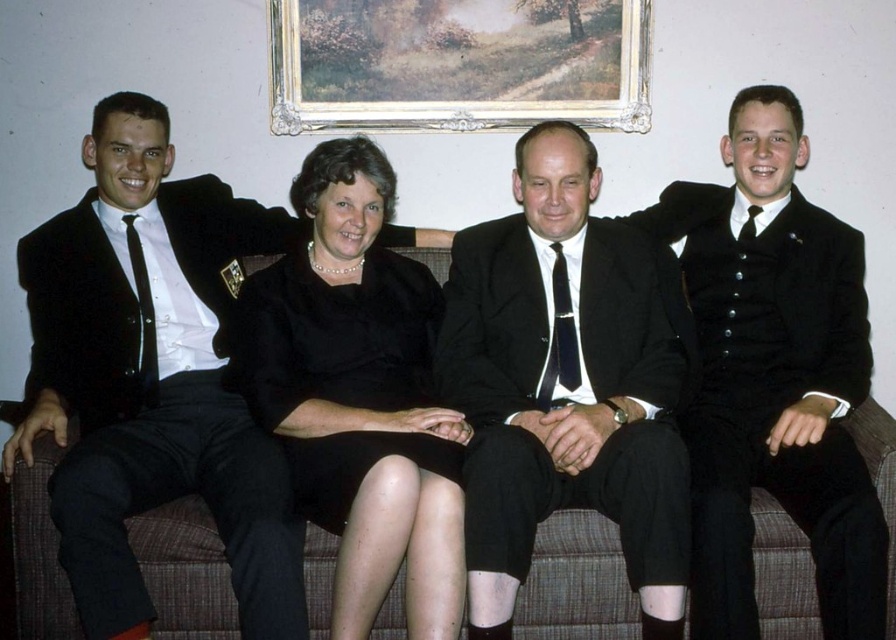
Question: Considering the real-world distances, which object is farthest from the matte black suit at left?

Choices:
 (A) black silk tie at center
 (B) white wood picture frame at upper center

Answer: (A)

Question: Which of the following is the closest to the observer?

Choices:
 (A) (340, 99)
 (B) (563, 236)
 (C) (563, 353)
 (D) (281, 276)

Answer: (C)

Question: Can you confirm if black satin suit at center is thinner than matte black tie at left?

Choices:
 (A) no
 (B) yes

Answer: (A)

Question: Can you confirm if brown fabric couch at center is positioned above white wood picture frame at upper center?

Choices:
 (A) no
 (B) yes

Answer: (A)

Question: Observing the image, what is the correct spatial positioning of black satin suit at center in reference to matte black tie at left?

Choices:
 (A) below
 (B) above

Answer: (A)

Question: Which object appears farthest from the camera in this image?

Choices:
 (A) black satin vest at right
 (B) matte black tie at left

Answer: (B)